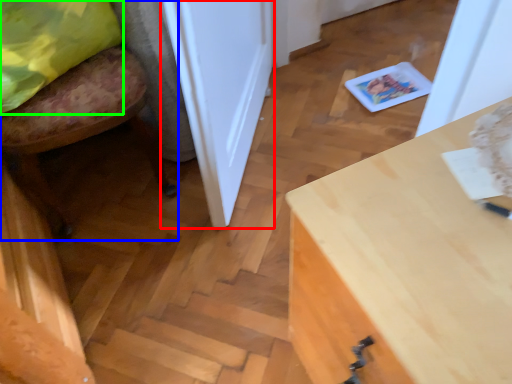
Question: Based on their relative distances, which object is farther from door (highlighted by a red box)? Choose from chair (highlighted by a blue box) and pillow (highlighted by a green box).

Choices:
 (A) chair
 (B) pillow

Answer: (B)